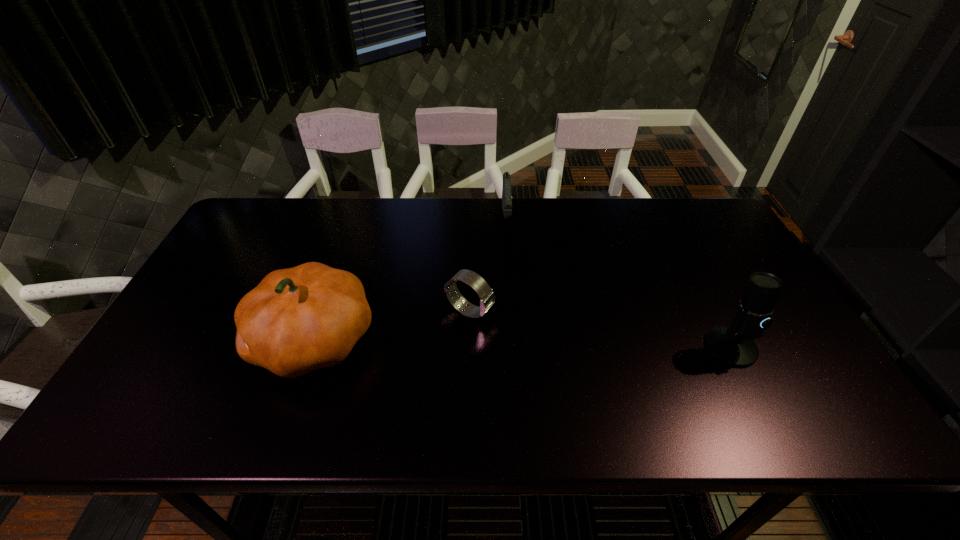
Identify the location of vacant space positioned 0.250m on the face of the watch. The image size is (960, 540). (578, 363).

Locate an element on the screen. This screenshot has width=960, height=540. vacant area located 0.210m on the face of the watch is located at coordinates (564, 355).

The width and height of the screenshot is (960, 540). In order to click on blank space located at the barrel of the third object from left to right in this screenshot , I will do `click(508, 253)`.

This screenshot has height=540, width=960. I want to click on vacant space located at the barrel of the third object from left to right, so click(x=510, y=291).

You are a GUI agent. You are given a task and a screenshot of the screen. Output one action in this format:
    pyautogui.click(x=<x>, y=<y>)
    Task: Click on the vacant space situated at the barrel of the third object from left to right
    
    Given the screenshot: What is the action you would take?
    pyautogui.click(x=508, y=251)

At what (x,y) coordinates should I click in order to perform the action: click on object present at the far edge. Please return your answer as a coordinate pair (x, y). Image resolution: width=960 pixels, height=540 pixels. Looking at the image, I should click on (506, 190).

Locate an element on the screen. This screenshot has height=540, width=960. pumpkin present at the near edge is located at coordinates (297, 320).

Find the location of a particular element. The width and height of the screenshot is (960, 540). microphone present at the near edge is located at coordinates (x=733, y=345).

This screenshot has width=960, height=540. What are the coordinates of `object that is positioned at the right edge` in the screenshot? It's located at (733, 345).

Identify the location of object that is positioned at the near right corner. (733, 345).